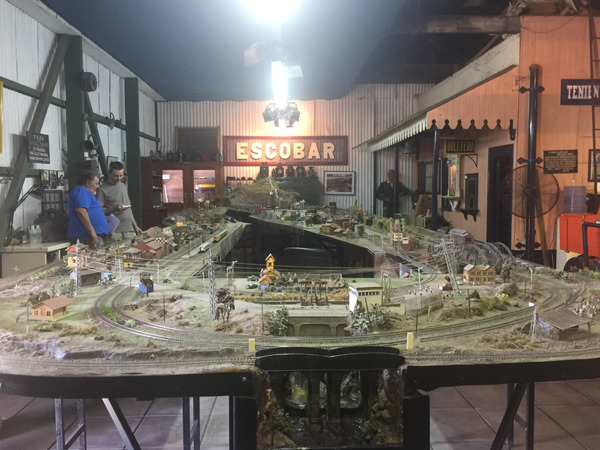
The image size is (600, 450). Identify the location of gray, tiled floor. (463, 420).